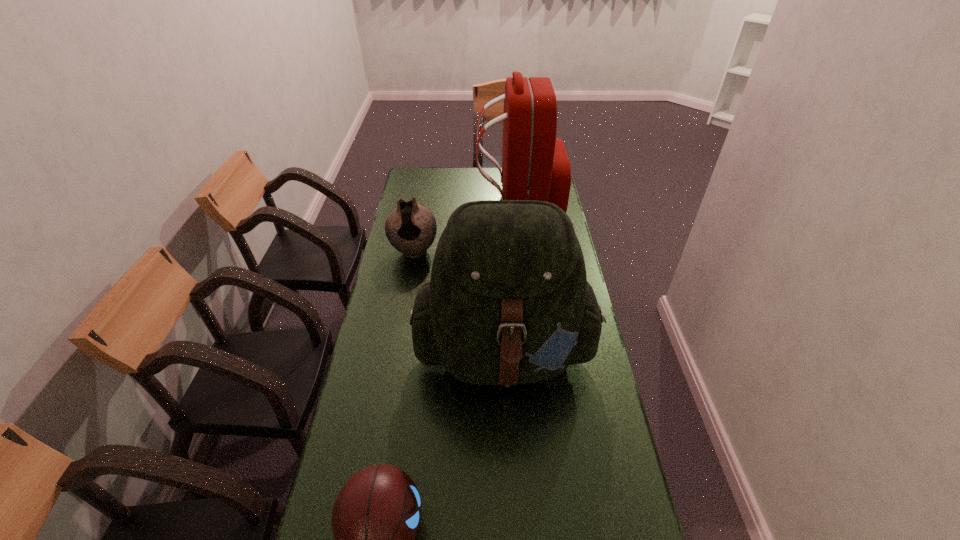
Find the location of a particular element. The height and width of the screenshot is (540, 960). object present at the left edge is located at coordinates (411, 229).

The height and width of the screenshot is (540, 960). Find the location of `object situated at the far right corner`. object situated at the far right corner is located at coordinates (535, 166).

In the image, there is a desktop. Identify the location of vacant space at the far edge. (460, 180).

The height and width of the screenshot is (540, 960). Find the location of `blank space at the left edge`. blank space at the left edge is located at coordinates (409, 323).

Locate an element on the screen. The height and width of the screenshot is (540, 960). vacant space at the right edge is located at coordinates (592, 366).

Where is `vacant space at the far left corner`? Image resolution: width=960 pixels, height=540 pixels. vacant space at the far left corner is located at coordinates (409, 186).

Select which object appears as the second closest to the farther backpack. Please provide its 2D coordinates. Your answer should be formatted as a tuple, i.e. [(x, y)], where the tuple contains the x and y coordinates of a point satisfying the conditions above.

[(508, 302)]

Locate which object is the closest to the basketball. Please provide its 2D coordinates. Your answer should be formatted as a tuple, i.e. [(x, y)], where the tuple contains the x and y coordinates of a point satisfying the conditions above.

[(508, 302)]

Locate an element on the screen. This screenshot has height=540, width=960. vacant point that satisfies the following two spatial constraints: 1. on the strap side of the farther backpack; 2. from the spout of the second farthest object is located at coordinates (524, 252).

Find the location of `free space in the image that satisfies the following two spatial constraints: 1. on the strap side of the farthest object; 2. from the spout of the pottery`. free space in the image that satisfies the following two spatial constraints: 1. on the strap side of the farthest object; 2. from the spout of the pottery is located at coordinates (524, 252).